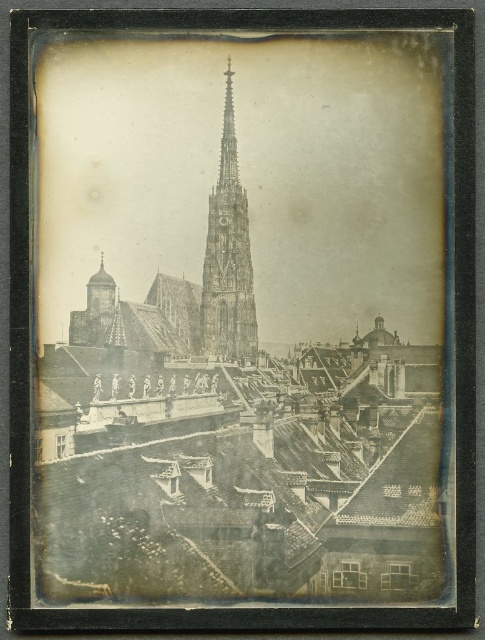
Question: Can you confirm if dark gray stone church at center is bigger than stone spire at center?

Choices:
 (A) no
 (B) yes

Answer: (B)

Question: Can you confirm if dark gray stone church at center is bigger than stone spire at center?

Choices:
 (A) yes
 (B) no

Answer: (A)

Question: Which point appears farthest from the camera in this image?

Choices:
 (A) (242, 276)
 (B) (333, 385)

Answer: (A)

Question: Which object appears farthest from the camera in this image?

Choices:
 (A) dark gray stone church at center
 (B) stone spire at center

Answer: (B)

Question: Is dark gray stone church at center positioned in front of stone spire at center?

Choices:
 (A) yes
 (B) no

Answer: (A)